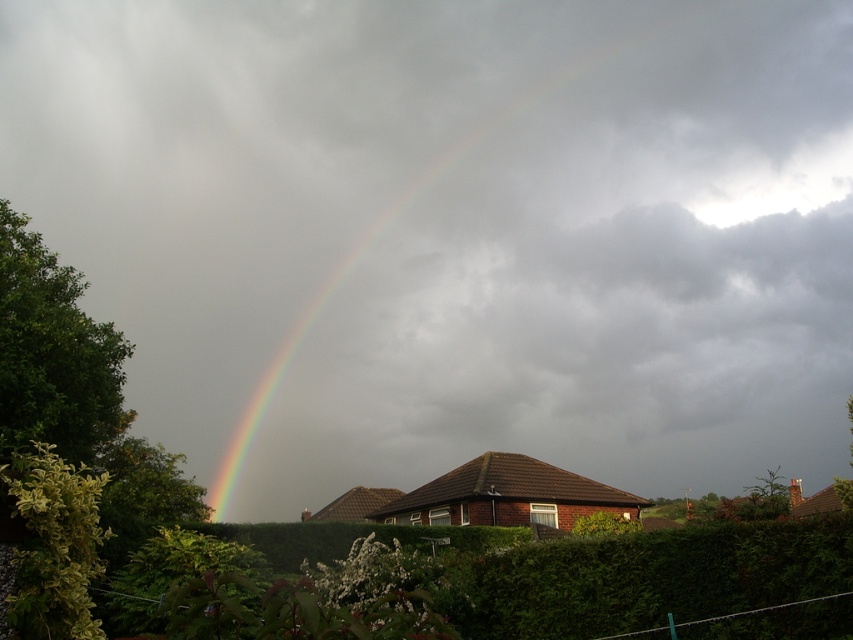
You are standing in the scene and want to place a small flag at each of the two points mentioned. If you first place a flag at point (236, 332) and then walk towards point (778, 560), will the second flag be visible from your new position?

Point (236, 332) is behind point (778, 560), so when you walk to point (778, 560), the flag at point (236, 332) will be hidden behind point (778, 560) and thus not visible.

You are standing in the garden and see the green leafy hedge at lower center and the green leafy hedge at lower left. Which hedge is wider?

The green leafy hedge at lower center might be wider than green leafy hedge at lower left.

You are standing in a garden and see the rainbow at upper center and the green leafy hedge at lower left. Which object is positioned to the left of the other?

The rainbow at upper center is positioned to the left of the green leafy hedge at lower left.